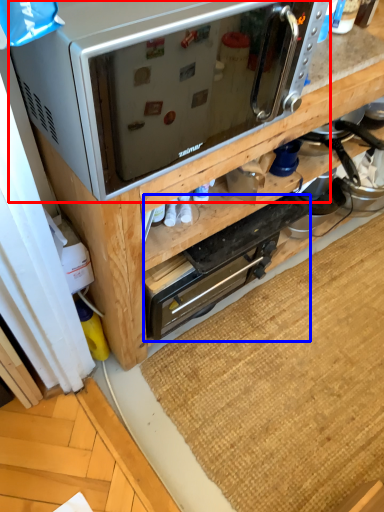
Question: Which of the following is the farthest to the observer, microwave oven (highlighted by a red box) or appliance (highlighted by a blue box)?

Choices:
 (A) microwave oven
 (B) appliance

Answer: (B)